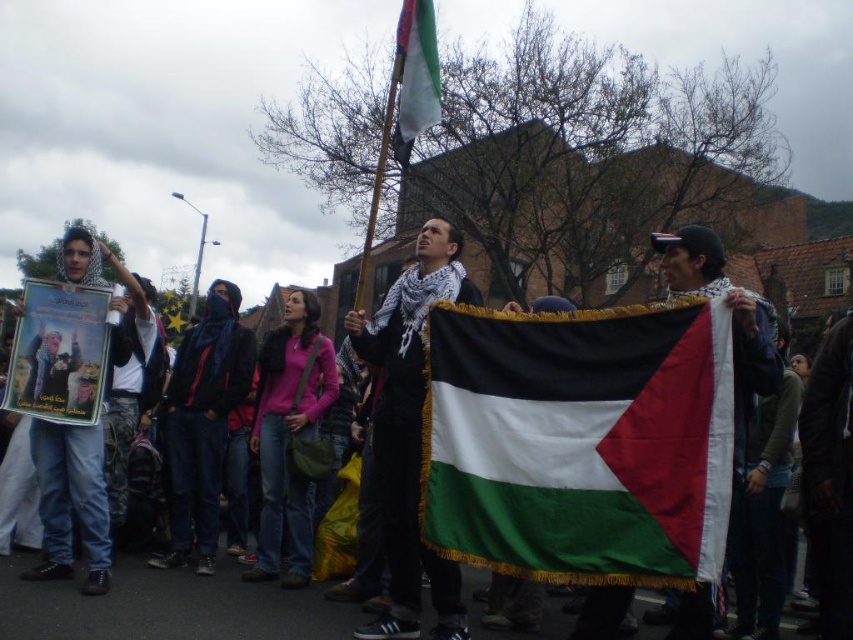
You are a photographer trying to capture the protest scene. You notice two points in the image at coordinates point (583,387) and point (405,465). Which point is closer to your camera lens?

Point (583,387) is closer to the viewer than point (405,465).

You are a photographer trying to capture the silky fabric flag at center and the white textured scarf at center in the same frame. Given that your camera has a fixed focal length, which object should you focus on first to ensure both are in focus?

The silky fabric flag at center is wider than the white textured scarf at center. To ensure both are in focus, you should focus on the silky fabric flag at center first since it is larger and requires more attention to detail.

You are a photographer trying to capture the silky fabric flag at center and the matte black scarf at center in a single shot. Based on their positions, which object will appear closer to the camera in the photo?

The silky fabric flag at center will appear closer to the camera because it is positioned over the matte black scarf at center.